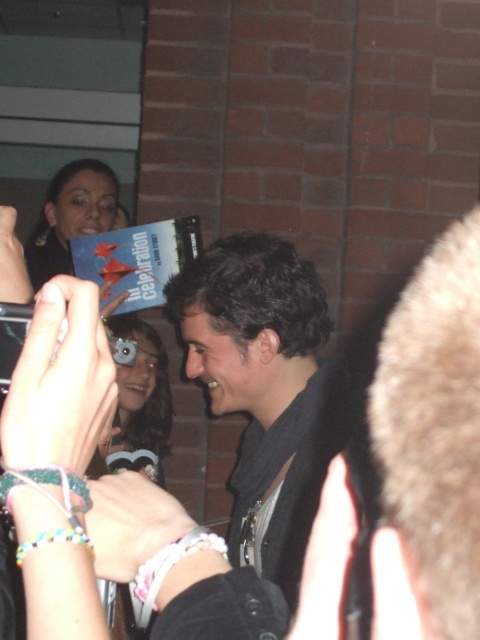
You are a photographer trying to capture the man with dark brown hair at center and the matte black camera at center in a single frame. Based on their heights, which object should you focus on first to ensure both are in the frame?

The dark brown hair at center is taller than the matte black camera at center, so you should focus on the dark brown hair at center first to ensure both are in the frame.

You are standing in the scene and want to take a photo of the central figure. The camera you are holding has a focal length of 50mm and a sensor size of 24mm x 36mm. The point at coordinates point (289, 337) is where the central figure is located. What is the minimum distance you need to be from the central figure to ensure the entire figure fits within the camera frame?

The point at coordinates point (289, 337) is 1.51 meters away from the viewer. To calculate the minimum distance required to fit the central figure within the camera frame, we first determine the field of view. Using the formula for horizontal field of view in degrees, FOV_horizontal_degrees, the central figure must be within this angle. However, since the exact dimensions of the central figure are not provided, we can only state that the viewer is already 1.51 meters away from the central figure. If the

You are a photographer trying to capture the man signing the book. Based on the scene, is the dark brown hair at center visible in the frame of the matte black camera at center?

The dark brown hair at center is above the matte black camera at center, so it would be visible in the frame.